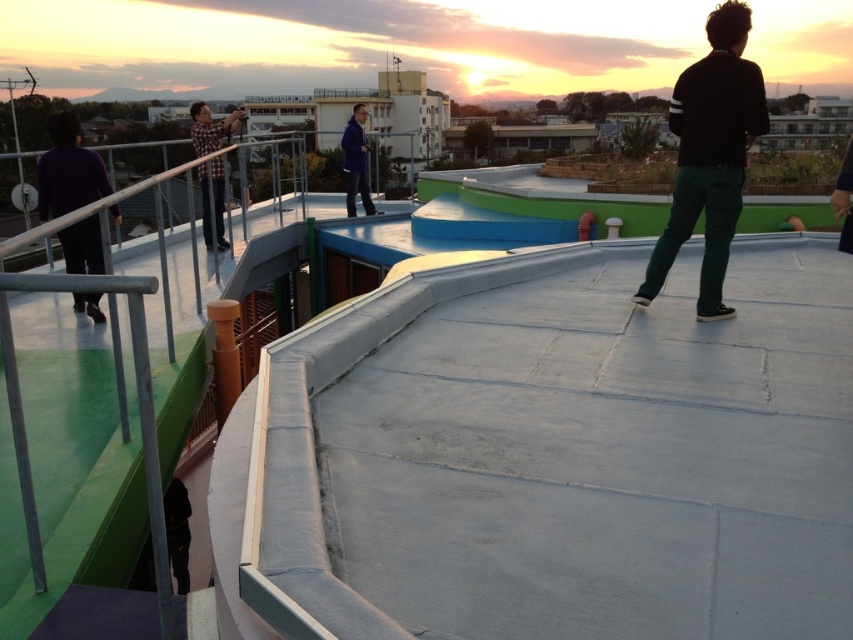
Question: Is purple matte pants at left below blue fabric jacket at center?

Choices:
 (A) yes
 (B) no

Answer: (A)

Question: Considering the real-world distances, which object is closest to the purple matte pants at left?

Choices:
 (A) plaid shirt at upper left
 (B) black matte sweater at upper right
 (C) blue fabric jacket at center

Answer: (A)

Question: Which point is closer to the camera taking this photo?

Choices:
 (A) (206, 209)
 (B) (677, 124)

Answer: (B)

Question: Can you confirm if plaid shirt at upper left is positioned to the right of blue fabric jacket at center?

Choices:
 (A) no
 (B) yes

Answer: (A)

Question: Is purple matte pants at left to the left of plaid shirt at upper left from the viewer's perspective?

Choices:
 (A) yes
 (B) no

Answer: (B)

Question: Which of the following is the closest to the observer?

Choices:
 (A) purple matte pants at left
 (B) black matte sweater at upper right
 (C) blue fabric jacket at center
 (D) plaid shirt at upper left

Answer: (A)